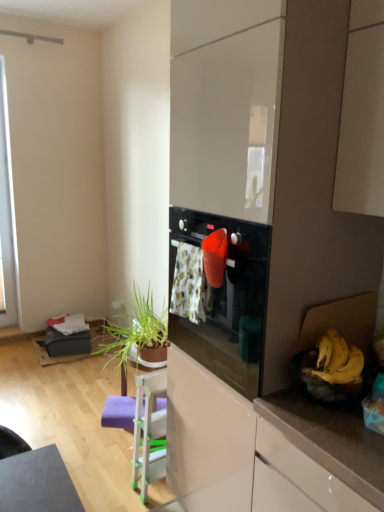
Question: Considering the positions of floral fabric laundry at center and white plastic chair at lower center in the image, is floral fabric laundry at center bigger or smaller than white plastic chair at lower center?

Choices:
 (A) big
 (B) small

Answer: (B)

Question: Is floral fabric laundry at center taller or shorter than white plastic chair at lower center?

Choices:
 (A) short
 (B) tall

Answer: (A)

Question: Which object is positioned closest to the green leafy plant at lower left?

Choices:
 (A) yellow matte bananas at right
 (B) white plastic chair at lower center
 (C) floral fabric laundry at center
 (D) glossy white dresser at center

Answer: (B)

Question: Which is nearer to the glossy white dresser at center?

Choices:
 (A) floral fabric laundry at center
 (B) green leafy plant at lower left
 (C) yellow matte bananas at right
 (D) white plastic chair at lower center

Answer: (A)